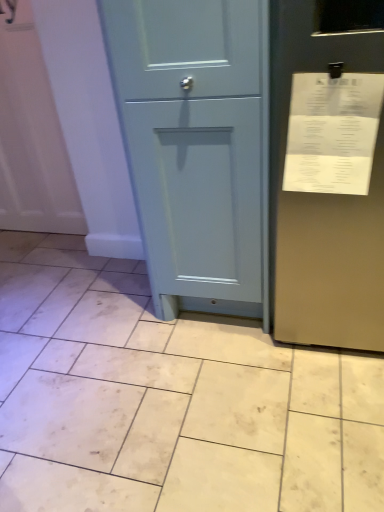
Question: Is beige matte tile at center, which is counted as the second ceramic tile, starting from the top, thinner than white paper receipt at upper right?

Choices:
 (A) yes
 (B) no

Answer: (B)

Question: From the image's perspective, is beige matte tile at center, the 1th ceramic tile from the bottom, below white paper receipt at upper right?

Choices:
 (A) yes
 (B) no

Answer: (A)

Question: Does beige matte tile at center, which is counted as the second ceramic tile, starting from the top, come in front of white paper receipt at upper right?

Choices:
 (A) yes
 (B) no

Answer: (A)

Question: From a real-world perspective, is beige matte tile at center, which is counted as the second ceramic tile, starting from the top, on white paper receipt at upper right?

Choices:
 (A) yes
 (B) no

Answer: (B)

Question: From the image's perspective, is beige matte tile at center, which is counted as the second ceramic tile, starting from the top, located above white paper receipt at upper right?

Choices:
 (A) no
 (B) yes

Answer: (A)

Question: Choose the correct answer: Is beige matte tile at center, which is counted as the second ceramic tile, starting from the top, inside white paper receipt at upper right or outside it?

Choices:
 (A) outside
 (B) inside

Answer: (A)

Question: Considering the positions of beige matte tile at center, the 1th ceramic tile from the bottom, and white paper receipt at upper right in the image, is beige matte tile at center, the 1th ceramic tile from the bottom, taller or shorter than white paper receipt at upper right?

Choices:
 (A) tall
 (B) short

Answer: (B)

Question: Looking at their shapes, would you say beige matte tile at center, which is counted as the second ceramic tile, starting from the top, is wider or thinner than white paper receipt at upper right?

Choices:
 (A) thin
 (B) wide

Answer: (B)

Question: From a real-world perspective, is beige matte tile at center, which is counted as the second ceramic tile, starting from the top, positioned above or below white paper receipt at upper right?

Choices:
 (A) below
 (B) above

Answer: (A)

Question: Is white paper receipt at upper right bigger or smaller than matte blue cabinet at center?

Choices:
 (A) big
 (B) small

Answer: (B)

Question: From a real-world perspective, is white paper receipt at upper right above or below matte blue cabinet at center?

Choices:
 (A) above
 (B) below

Answer: (A)

Question: Is white paper receipt at upper right wider or thinner than matte blue cabinet at center?

Choices:
 (A) thin
 (B) wide

Answer: (A)

Question: Which is correct: white paper receipt at upper right is inside matte blue cabinet at center, or outside of it?

Choices:
 (A) outside
 (B) inside

Answer: (A)

Question: Looking at the image, does white glossy tile at lower left, which is the 1th ceramic tile from top to bottom, seem bigger or smaller compared to white paper receipt at upper right?

Choices:
 (A) big
 (B) small

Answer: (B)

Question: Is white glossy tile at lower left, acting as the second ceramic tile starting from the bottom, in front of or behind white paper receipt at upper right in the image?

Choices:
 (A) front
 (B) behind

Answer: (B)